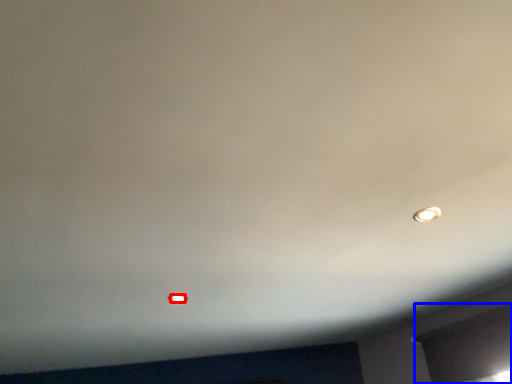
Question: Which object appears closest to the camera in this image, light bulb (highlighted by a red box) or window (highlighted by a blue box)?

Choices:
 (A) light bulb
 (B) window

Answer: (B)